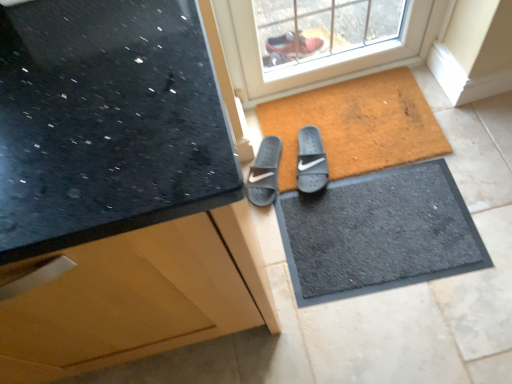
Locate an element on the screen. free space to the back side of gray rubber slide at center, which ranks as the 2th footwear in left-to-right order is located at coordinates (293, 116).